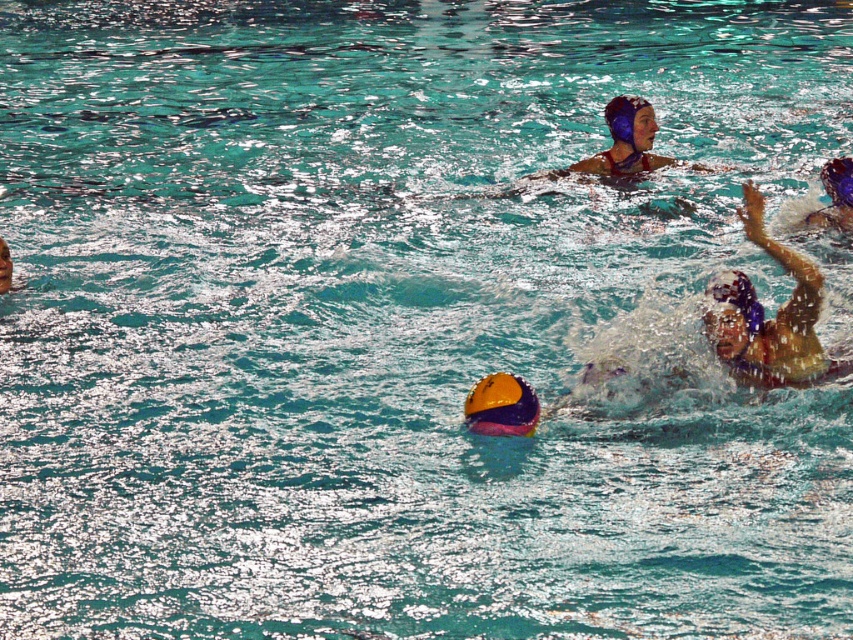
Question: Is matte blue swim cap at upper center smaller than smooth skin face at lower left?

Choices:
 (A) no
 (B) yes

Answer: (A)

Question: Which of the following is the closest to the observer?

Choices:
 (A) purple matte swim cap at upper right
 (B) blue glossy swim cap at upper right

Answer: (A)

Question: Observing the image, what is the correct spatial positioning of blue glossy swim cap at upper right in reference to blue matte swim cap at center?

Choices:
 (A) below
 (B) above

Answer: (B)

Question: Can you confirm if yellow and purple helmet at lower right is positioned above purple matte swim cap at upper center?

Choices:
 (A) yes
 (B) no

Answer: (B)

Question: Which point is farther to the camera?

Choices:
 (A) (643, 104)
 (B) (10, 282)
 (C) (515, 410)

Answer: (A)

Question: Among these objects, which one is farthest from the camera?

Choices:
 (A) matte blue swim cap at upper center
 (B) yellow and purple helmet at lower right
 (C) smooth skin face at lower left
 (D) purple matte swim cap at upper right

Answer: (A)